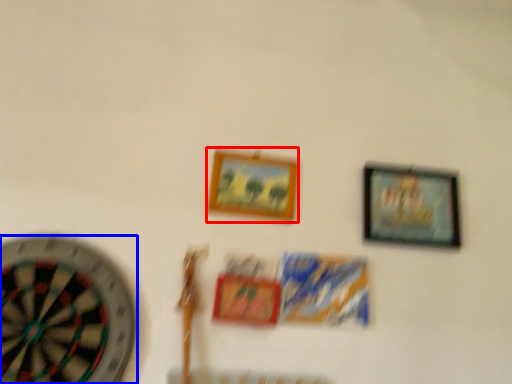
Question: Which of the following is the farthest to the observer, picture frame (highlighted by a red box) or wheel (highlighted by a blue box)?

Choices:
 (A) picture frame
 (B) wheel

Answer: (A)